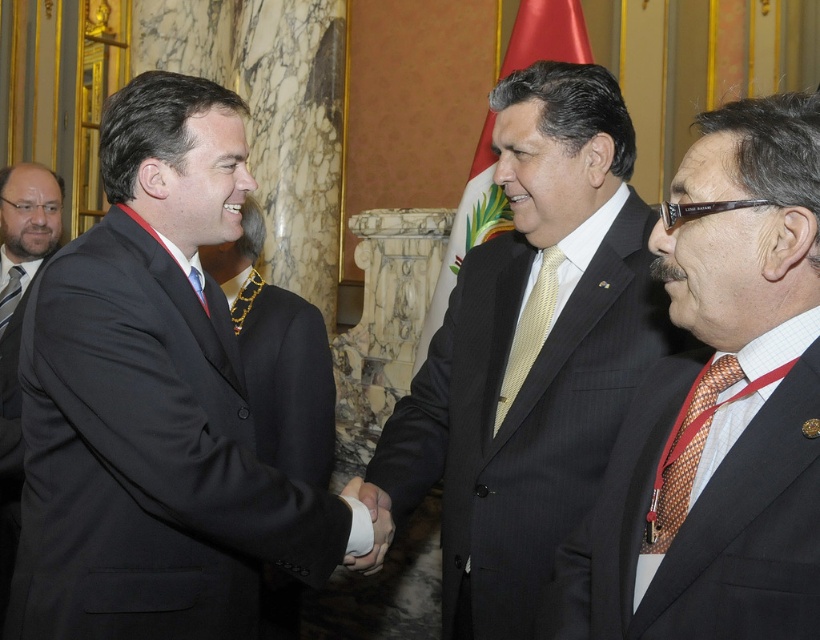
You are attending this formal event and need to determine the spatial relationship between the two gentlemen based on their attire. Is the pinstriped wool suit at right closer to the front or the back of the matte black tie at left?

The pinstriped wool suit at right is positioned under matte black tie at left, meaning it is located behind the matte black tie at left and thus closer to the back.

You are an event organizer who needs to ensure proper seating arrangements. Given that the black matte suit at center and the yellow textured tie at center are both present at the event, which one would require a larger seating space due to its size?

The black matte suit at center has a larger size compared to the yellow textured tie at center, so it would require a larger seating space.